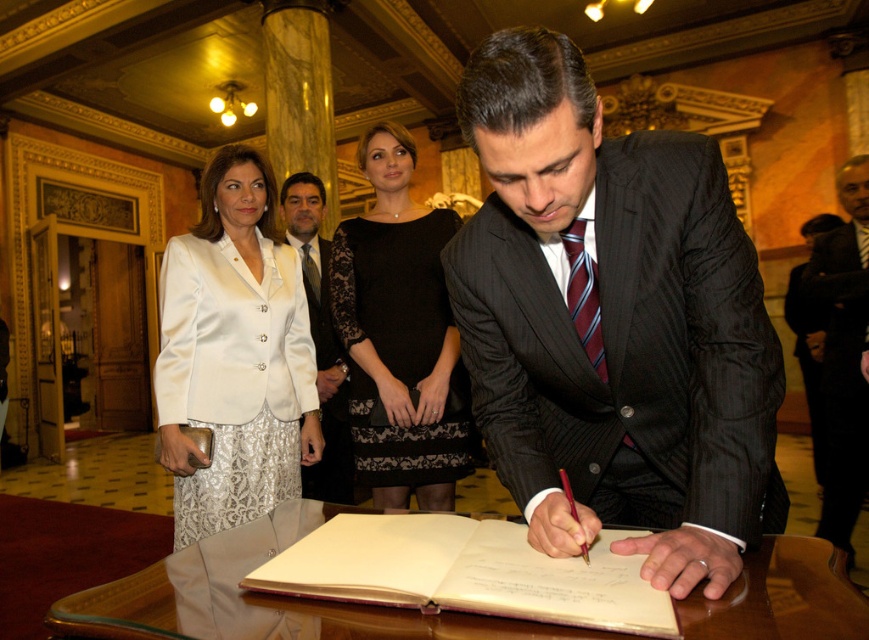
Question: Can you confirm if transparent glass table at center is smaller than dark gray suit at right?

Choices:
 (A) yes
 (B) no

Answer: (A)

Question: Does black lace dress at center have a larger size compared to dark gray suit at right?

Choices:
 (A) no
 (B) yes

Answer: (B)

Question: Can you confirm if black lace dress at center is bigger than off-white paper at center?

Choices:
 (A) no
 (B) yes

Answer: (B)

Question: Which point appears closest to the camera in this image?

Choices:
 (A) (390, 588)
 (B) (229, 378)

Answer: (A)

Question: Which object is positioned farthest from the white satin suit at upper left?

Choices:
 (A) off-white paper at center
 (B) dark gray pinstripe suit at center

Answer: (A)

Question: Which of these objects is positioned farthest from the transparent glass table at center?

Choices:
 (A) satin white blazer at upper left
 (B) dark gray pinstripe suit at center
 (C) white satin suit at upper left
 (D) black lace dress at center

Answer: (C)